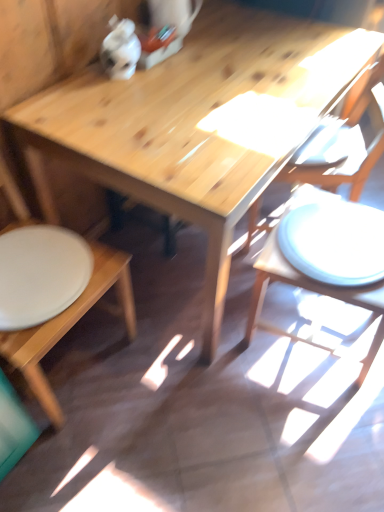
Question: Is white matte plate at lower left bigger than wooden table at center?

Choices:
 (A) yes
 (B) no

Answer: (B)

Question: Is white matte plate at lower left outside wooden table at center?

Choices:
 (A) yes
 (B) no

Answer: (A)

Question: Are white matte plate at lower left and wooden table at center beside each other?

Choices:
 (A) no
 (B) yes

Answer: (A)

Question: From the image's perspective, does white matte plate at lower left appear higher than wooden table at center?

Choices:
 (A) yes
 (B) no

Answer: (B)

Question: From a real-world perspective, is white matte plate at lower left on wooden table at center?

Choices:
 (A) yes
 (B) no

Answer: (A)

Question: Is white matte plate at lower left in front of or behind wooden chair at lower left, which is the 2th chair from right to left, in the image?

Choices:
 (A) behind
 (B) front

Answer: (A)

Question: From their relative heights in the image, would you say white matte plate at lower left is taller or shorter than wooden chair at lower left, which is the 2th chair from right to left?

Choices:
 (A) short
 (B) tall

Answer: (A)

Question: Looking at their shapes, would you say white matte plate at lower left is wider or thinner than wooden chair at lower left, which is the 2th chair from right to left?

Choices:
 (A) thin
 (B) wide

Answer: (A)

Question: From a real-world perspective, is white matte plate at lower left positioned above or below wooden chair at lower left, which is the 2th chair from right to left?

Choices:
 (A) below
 (B) above

Answer: (B)

Question: Is wooden chair at lower left, which is the 2th chair from right to left, to the left or to the right of wooden chair at right, placed as the first chair when sorted from right to left, in the image?

Choices:
 (A) right
 (B) left

Answer: (B)

Question: Is point [117, 305] closer or farther from the camera than point [258, 198]?

Choices:
 (A) farther
 (B) closer

Answer: (B)

Question: From a real-world perspective, is wooden chair at lower left, positioned as the first chair in left-to-right order, physically located above or below wooden chair at right, placed as the first chair when sorted from right to left?

Choices:
 (A) below
 (B) above

Answer: (B)

Question: From the image's perspective, relative to wooden chair at right, the second chair positioned from the left, is wooden chair at lower left, positioned as the first chair in left-to-right order, above or below?

Choices:
 (A) below
 (B) above

Answer: (A)

Question: Does point (304, 105) appear closer or farther from the camera than point (256, 202)?

Choices:
 (A) closer
 (B) farther

Answer: (A)

Question: Do you think wooden table at center is within wooden chair at right, placed as the first chair when sorted from right to left, or outside of it?

Choices:
 (A) outside
 (B) inside

Answer: (A)